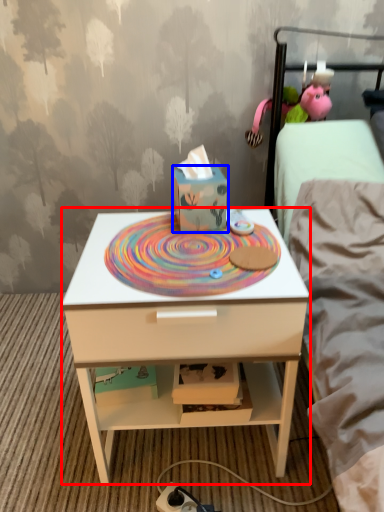
Question: Which object is closer to the camera taking this photo, nightstand (highlighted by a red box) or cardboard box (highlighted by a blue box)?

Choices:
 (A) nightstand
 (B) cardboard box

Answer: (A)